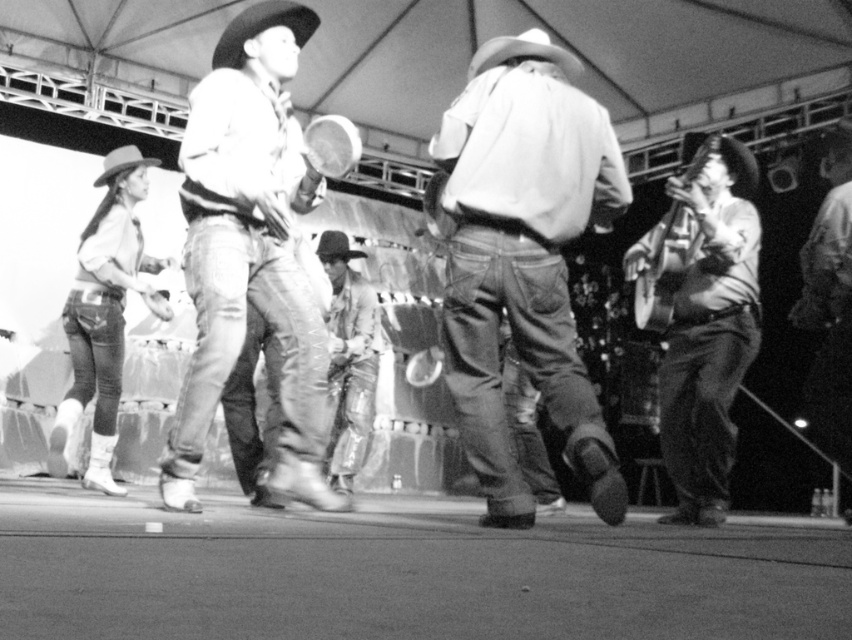
Question: Can you confirm if ripped denim jeans at center is positioned below rustic leather guitar at right?

Choices:
 (A) yes
 (B) no

Answer: (B)

Question: Is ripped denim jeans at center to the right of leather cowboy boots at center from the viewer's perspective?

Choices:
 (A) no
 (B) yes

Answer: (B)

Question: Considering the real-world distances, which object is closest to the rustic leather guitar at right?

Choices:
 (A) leather cowboy boots at center
 (B) denim jeans at center
 (C) ripped denim jeans at center

Answer: (C)

Question: Which object is the closest to the ripped denim jeans at center?

Choices:
 (A) leather cowboy boots at center
 (B) rustic leather guitar at right

Answer: (B)

Question: Can you confirm if ripped denim jeans at center is positioned below leather cowboy boots at center?

Choices:
 (A) no
 (B) yes

Answer: (A)

Question: Estimate the real-world distances between objects in this image. Which object is closer to the denim jeans at center?

Choices:
 (A) leather cowboy boots at center
 (B) ripped denim jeans at center

Answer: (B)